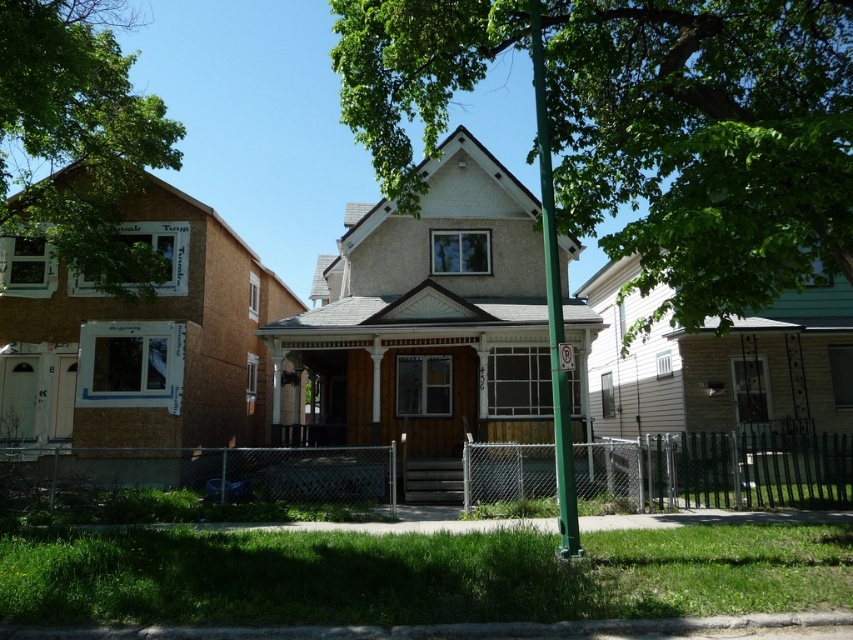
You are standing on the residential street and see the green leafy tree at center and the green leafy tree at left. Which tree is nearer to you?

The green leafy tree at center is closer to the viewer than the green leafy tree at left, so the green leafy tree at center is nearer to you.

You are standing on the residential street and want to take a photo of the green metallic pole at center without the green leafy tree at center blocking it. What should you do?

Move to a position where the green leafy tree at center is no longer between you and the green metallic pole at center. Since the green leafy tree at center is in front of the green metallic pole at center, moving to the side or behind the tree would allow you to capture the pole without obstruction.

You are a delivery driver approaching the residential street and need to park your vehicle. You see the green metallic pole at center and the metallic reflective no parking sign at center. According to the scene, is the no parking sign above or below the green pole?

The green metallic pole at center is located below the metallic reflective no parking sign at center, so the no parking sign is above the green pole.